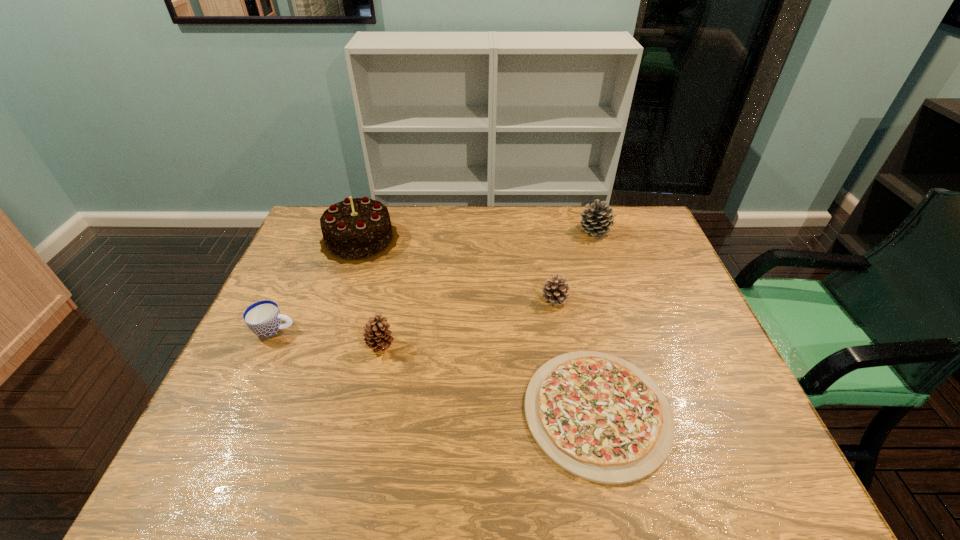
Identify the location of birthday cake. This screenshot has height=540, width=960. (359, 230).

Locate an element on the screen. The image size is (960, 540). the rightmost pinecone is located at coordinates (596, 221).

This screenshot has height=540, width=960. Identify the location of the nearest pinecone. coord(377,336).

What are the coordinates of `the second pinecone from left to right` in the screenshot? It's located at (555, 291).

At what (x,y) coordinates should I click in order to perform the action: click on the third farthest object. Please return your answer as a coordinate pair (x, y). Looking at the image, I should click on (555, 291).

Image resolution: width=960 pixels, height=540 pixels. What are the coordinates of `the fifth tallest object` in the screenshot? It's located at (263, 318).

Where is `the shortest object`? Image resolution: width=960 pixels, height=540 pixels. the shortest object is located at coordinates (600, 418).

Locate an element on the screen. free region located 0.360m on the right of the tallest object is located at coordinates (505, 239).

The image size is (960, 540). Identify the location of vacant area located 0.390m on the left of the farthest pinecone. (467, 231).

Image resolution: width=960 pixels, height=540 pixels. I want to click on free space located on the back of the nearest pinecone, so click(387, 315).